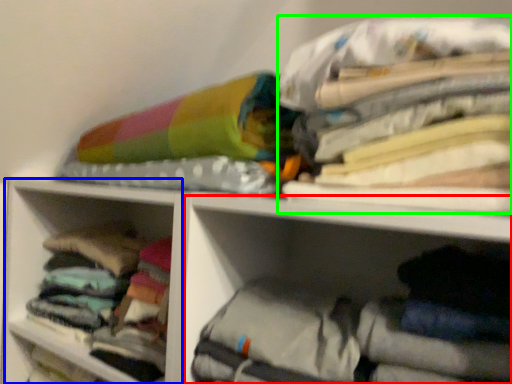
Question: Based on their relative distances, which object is nearer to cabinet (highlighted by a red box)? Choose from cabinet (highlighted by a blue box) and clothing (highlighted by a green box).

Choices:
 (A) cabinet
 (B) clothing

Answer: (B)